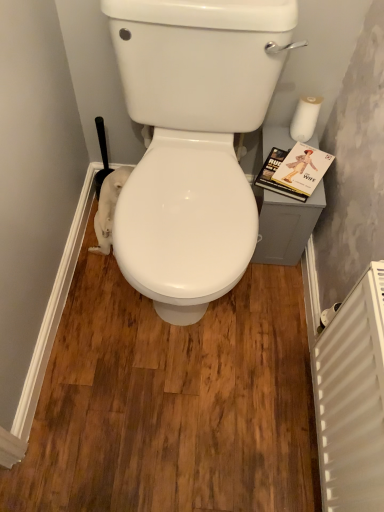
Describe the element at coordinates (108, 208) in the screenshot. The width and height of the screenshot is (384, 512). I see `white matte toilet paper at lower right, the 2th toilet paper positioned from the top` at that location.

Measure the distance between white matte toilet paper at upper right, which is the 1th toilet paper in right-to-left order, and camera.

They are 4.18 feet apart.

Describe the element at coordinates (305, 118) in the screenshot. I see `white matte toilet paper at upper right, which is the 1th toilet paper in right-to-left order` at that location.

Find the location of `white glossy toilet at center`. white glossy toilet at center is located at coordinates (193, 141).

What do you see at coordinates (193, 141) in the screenshot? This screenshot has width=384, height=512. I see `white glossy toilet at center` at bounding box center [193, 141].

Describe the element at coordinates (294, 170) in the screenshot. I see `hardcover book at right` at that location.

You are a GUI agent. You are given a task and a screenshot of the screen. Output one action in this format:
    pyautogui.click(x=<x>, y=<y>)
    Task: Click on the white matte toilet paper at lower right, the 1th toilet paper in the left-to-right sequence
    The height and width of the screenshot is (512, 384).
    Given the screenshot: What is the action you would take?
    pyautogui.click(x=108, y=208)

From a real-world perspective, which is physically above, white matte toilet paper at upper right, placed as the first toilet paper when sorted from top to bottom, or white glossy toilet at center?

In real-world perspective, white matte toilet paper at upper right, placed as the first toilet paper when sorted from top to bottom, is above.

From the image's perspective, is white matte toilet paper at upper right, which is counted as the second toilet paper, starting from the bottom, above or below white glossy toilet at center?

white matte toilet paper at upper right, which is counted as the second toilet paper, starting from the bottom, is situated higher than white glossy toilet at center in the image.

Does white matte toilet paper at upper right, which is counted as the second toilet paper, starting from the bottom, have a lesser width compared to white glossy toilet at center?

Yes.

Can we say white glossy toilet at center lies outside white matte toilet paper at upper right, placed as the first toilet paper when sorted from top to bottom?

Yes, white glossy toilet at center is outside of white matte toilet paper at upper right, placed as the first toilet paper when sorted from top to bottom.

Locate an element on the screen. This screenshot has height=512, width=384. porcelain located in front of the white matte toilet paper at upper right, which is counted as the second toilet paper, starting from the bottom is located at coordinates (193, 141).

Is point (223, 49) positioned behind point (309, 99)?

No, it is in front of (309, 99).

Consider the image. Is there a large distance between white matte toilet paper at upper right, which is counted as the second toilet paper, starting from the bottom, and white matte toilet paper at lower right, placed as the second toilet paper when sorted from right to left?

white matte toilet paper at upper right, which is counted as the second toilet paper, starting from the bottom, is near white matte toilet paper at lower right, placed as the second toilet paper when sorted from right to left, not far away.

In the scene shown: Is white matte toilet paper at upper right, which is the 1th toilet paper in right-to-left order, positioned with its back to white matte toilet paper at lower right, placed as the second toilet paper when sorted from right to left?

No, white matte toilet paper at lower right, placed as the second toilet paper when sorted from right to left, is not at the back of white matte toilet paper at upper right, which is the 1th toilet paper in right-to-left order.

Based on their sizes in the image, would you say white matte toilet paper at upper right, which is counted as the second toilet paper, starting from the bottom, is bigger or smaller than white matte toilet paper at lower right, placed as the second toilet paper when sorted from right to left?

Clearly, white matte toilet paper at upper right, which is counted as the second toilet paper, starting from the bottom, is smaller in size than white matte toilet paper at lower right, placed as the second toilet paper when sorted from right to left.

Is white matte toilet paper at upper right, which ranks as the 2th toilet paper in left-to-right order, further to the viewer compared to white matte toilet paper at lower right, the 2th toilet paper positioned from the top?

No, white matte toilet paper at upper right, which ranks as the 2th toilet paper in left-to-right order, is in front of white matte toilet paper at lower right, the 2th toilet paper positioned from the top.

Can you tell me how much white matte toilet paper at upper right, placed as the first toilet paper when sorted from top to bottom, and hardcover book at right differ in facing direction?

white matte toilet paper at upper right, placed as the first toilet paper when sorted from top to bottom, and hardcover book at right are facing 21.6 degrees away from each other.

From a real-world perspective, which is physically below, white matte toilet paper at upper right, which ranks as the 2th toilet paper in left-to-right order, or hardcover book at right?

hardcover book at right.

Is white matte toilet paper at upper right, which is counted as the second toilet paper, starting from the bottom, next to hardcover book at right?

No, white matte toilet paper at upper right, which is counted as the second toilet paper, starting from the bottom, is not in contact with hardcover book at right.

Does white matte toilet paper at upper right, which ranks as the 2th toilet paper in left-to-right order, contain hardcover book at right?

No, white matte toilet paper at upper right, which ranks as the 2th toilet paper in left-to-right order, does not contain hardcover book at right.

Considering the relative positions of white plastic radiator at lower right and hardcover book at right in the image provided, is white plastic radiator at lower right behind hardcover book at right?

No, white plastic radiator at lower right is in front of hardcover book at right.

Is point (321, 335) positioned behind point (299, 190)?

No, (321, 335) is in front of (299, 190).

Which of these two, white plastic radiator at lower right or hardcover book at right, stands shorter?

hardcover book at right.

Does white plastic radiator at lower right appear on the left side of hardcover book at right?

No, white plastic radiator at lower right is not to the left of hardcover book at right.

Which of these two, white plastic radiator at lower right or white glossy toilet at center, is smaller?

white plastic radiator at lower right.

Does white plastic radiator at lower right appear on the left side of white glossy toilet at center?

No, white plastic radiator at lower right is not to the left of white glossy toilet at center.

What's the angular difference between white plastic radiator at lower right and white glossy toilet at center's facing directions?

There is a 88.9-degree angle between the facing directions of white plastic radiator at lower right and white glossy toilet at center.

From the image's perspective, is white plastic radiator at lower right located beneath white glossy toilet at center?

Yes, from the image's perspective, white plastic radiator at lower right is below white glossy toilet at center.

Looking at the image, does hardcover book at right seem bigger or smaller compared to white matte toilet paper at lower right, the 2th toilet paper positioned from the top?

Considering their sizes, hardcover book at right takes up less space than white matte toilet paper at lower right, the 2th toilet paper positioned from the top.

Is white matte toilet paper at lower right, placed as the second toilet paper when sorted from right to left, located within hardcover book at right?

No, white matte toilet paper at lower right, placed as the second toilet paper when sorted from right to left, is not a part of hardcover book at right.

From the image's perspective, is hardcover book at right positioned above or below white matte toilet paper at lower right, placed as the second toilet paper when sorted from right to left?

Clearly, from the image's perspective, hardcover book at right is above white matte toilet paper at lower right, placed as the second toilet paper when sorted from right to left.

Where is `toilet paper directly beneath the hardcover book at right (from a real-world perspective)`? This screenshot has height=512, width=384. toilet paper directly beneath the hardcover book at right (from a real-world perspective) is located at coordinates (108, 208).

Where is `porcelain located on the left of white matte toilet paper at upper right, which ranks as the 2th toilet paper in left-to-right order`? The width and height of the screenshot is (384, 512). porcelain located on the left of white matte toilet paper at upper right, which ranks as the 2th toilet paper in left-to-right order is located at coordinates point(193,141).

You are a GUI agent. You are given a task and a screenshot of the screen. Output one action in this format:
    pyautogui.click(x=<x>, y=<y>)
    Task: Click on the toilet paper that is above the white glossy toilet at center (from the image's perspective)
    
    Given the screenshot: What is the action you would take?
    pyautogui.click(x=305, y=118)

Based on their spatial positions, is white matte toilet paper at lower right, the 1th toilet paper in the left-to-right sequence, or white matte toilet paper at upper right, which ranks as the 2th toilet paper in left-to-right order, closer to hardcover book at right?

white matte toilet paper at upper right, which ranks as the 2th toilet paper in left-to-right order, is positioned closer to the anchor hardcover book at right.

Estimate the real-world distances between objects in this image. Which object is further from white glossy toilet at center, hardcover book at right or white plastic radiator at lower right?

white plastic radiator at lower right is further to white glossy toilet at center.

When comparing their distances from white glossy toilet at center, does white plastic radiator at lower right or hardcover book at right seem closer?

hardcover book at right lies closer to white glossy toilet at center than the other object.

Looking at the image, which one is located closer to white matte toilet paper at upper right, placed as the first toilet paper when sorted from top to bottom, white glossy toilet at center or white matte toilet paper at lower right, the 1th toilet paper when ordered from bottom to top?

white glossy toilet at center.

Considering their positions, is hardcover book at right positioned further to white plastic radiator at lower right than white matte toilet paper at lower right, the 2th toilet paper positioned from the top?

white matte toilet paper at lower right, the 2th toilet paper positioned from the top, is positioned further to the anchor white plastic radiator at lower right.

Estimate the real-world distances between objects in this image. Which object is further from hardcover book at right, white glossy toilet at center or white matte toilet paper at lower right, the 1th toilet paper when ordered from bottom to top?

white matte toilet paper at lower right, the 1th toilet paper when ordered from bottom to top, lies further to hardcover book at right than the other object.

Which object lies nearer to the anchor point white plastic radiator at lower right, hardcover book at right or white glossy toilet at center?

white glossy toilet at center is closer to white plastic radiator at lower right.

When comparing their distances from white matte toilet paper at upper right, which ranks as the 2th toilet paper in left-to-right order, does white matte toilet paper at lower right, placed as the second toilet paper when sorted from right to left, or hardcover book at right seem further?

Based on the image, white matte toilet paper at lower right, placed as the second toilet paper when sorted from right to left, appears to be further to white matte toilet paper at upper right, which ranks as the 2th toilet paper in left-to-right order.

At what (x,y) coordinates should I click in order to perform the action: click on toilet paper positioned between white plastic radiator at lower right and white matte toilet paper at lower right, placed as the second toilet paper when sorted from right to left, from near to far. Please return your answer as a coordinate pair (x, y). Image resolution: width=384 pixels, height=512 pixels. Looking at the image, I should click on (305, 118).

Where is `porcelain located between white plastic radiator at lower right and white matte toilet paper at lower right, the 1th toilet paper in the left-to-right sequence, in the depth direction`? porcelain located between white plastic radiator at lower right and white matte toilet paper at lower right, the 1th toilet paper in the left-to-right sequence, in the depth direction is located at coordinates (193, 141).

Locate an element on the screen. paperback book located between white glossy toilet at center and white matte toilet paper at lower right, the 2th toilet paper positioned from the top, in the depth direction is located at coordinates (294, 170).

Locate an element on the screen. The width and height of the screenshot is (384, 512). paperback book between white matte toilet paper at lower right, the 1th toilet paper when ordered from bottom to top, and white matte toilet paper at upper right, which is the 1th toilet paper in right-to-left order, in the horizontal direction is located at coordinates 294,170.